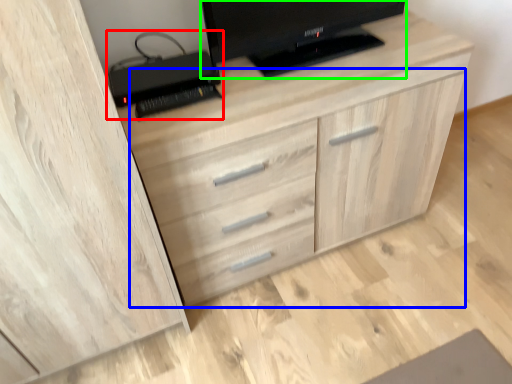
Question: Based on their relative distances, which object is nearer to computer (highlighted by a red box)? Choose from dresser (highlighted by a blue box) and television (highlighted by a green box).

Choices:
 (A) dresser
 (B) television

Answer: (B)